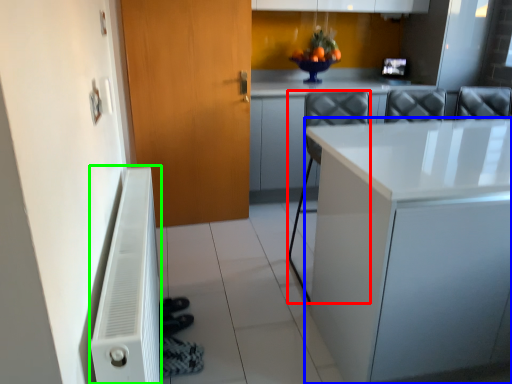
Question: Which object is the farthest from chair (highlighted by a red box)? Choose among these: countertop (highlighted by a blue box) or radiator (highlighted by a green box).

Choices:
 (A) countertop
 (B) radiator

Answer: (B)